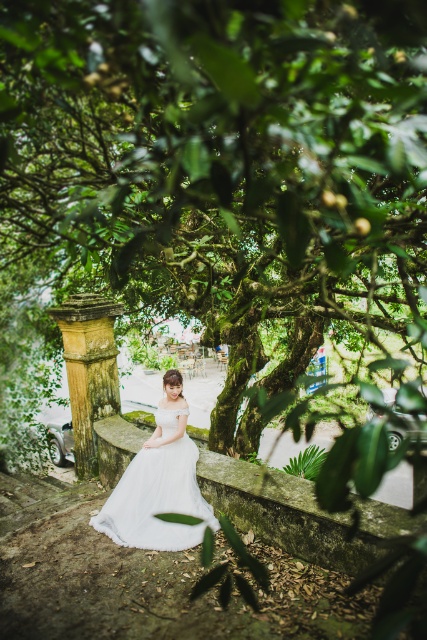
Question: Where is green mossy tree at center located in relation to white tulle dress at center in the image?

Choices:
 (A) above
 (B) below

Answer: (A)

Question: Which object is the closest to the stone column at center?

Choices:
 (A) white tulle dress at center
 (B) green mossy tree at center

Answer: (A)

Question: Can you confirm if white tulle dress at center is positioned to the right of stone column at center?

Choices:
 (A) yes
 (B) no

Answer: (A)

Question: Which point is farther from the camera taking this photo?

Choices:
 (A) (116, 196)
 (B) (87, 330)
 (C) (146, 476)

Answer: (B)

Question: Among these objects, which one is farthest from the camera?

Choices:
 (A) green mossy tree at center
 (B) stone column at center

Answer: (B)

Question: Can you confirm if green mossy tree at center is positioned above white tulle dress at center?

Choices:
 (A) yes
 (B) no

Answer: (A)